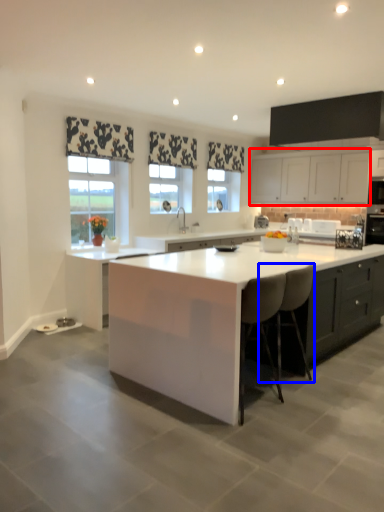
Question: Which object is further to the camera taking this photo, cabinetry (highlighted by a red box) or chair (highlighted by a blue box)?

Choices:
 (A) cabinetry
 (B) chair

Answer: (A)